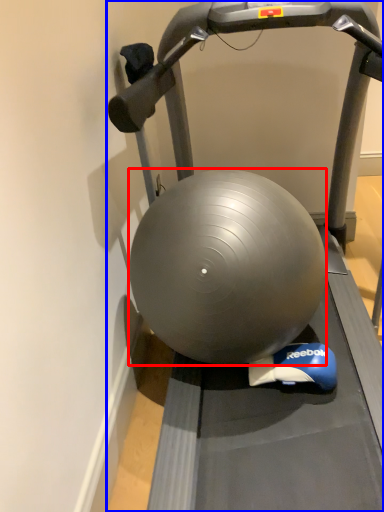
Question: Which object appears farthest to the camera in this image, ball (highlighted by a red box) or treadmill (highlighted by a blue box)?

Choices:
 (A) ball
 (B) treadmill

Answer: (A)